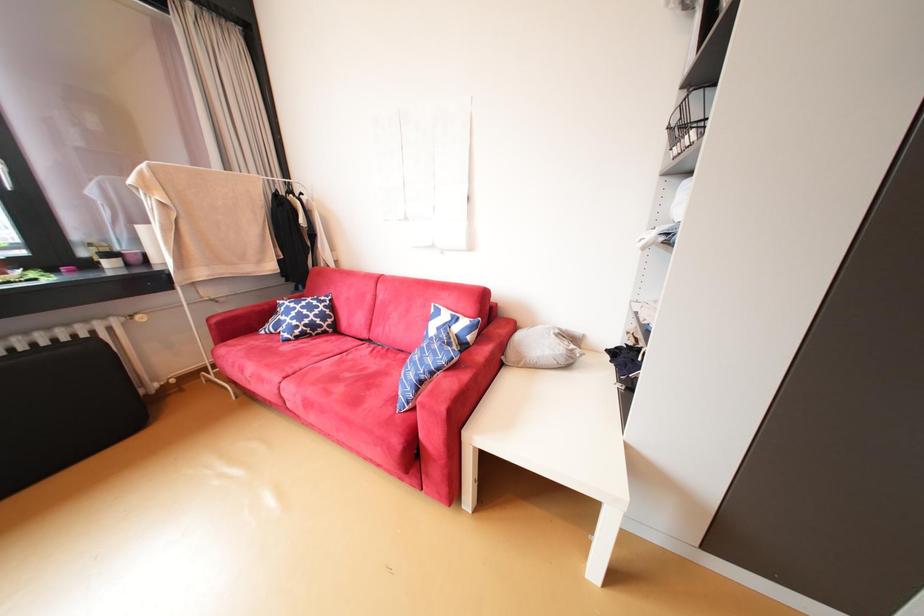
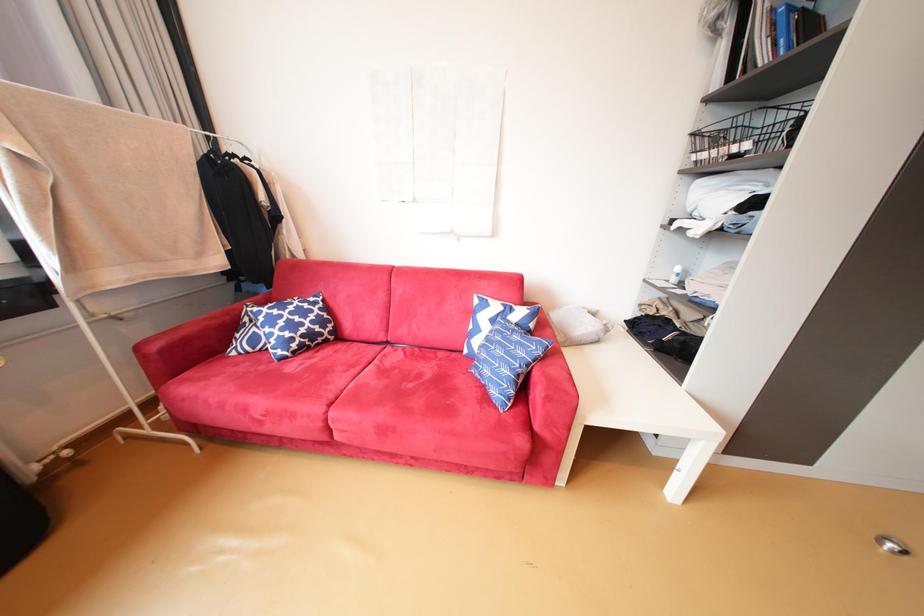
Question: The camera is either moving clockwise (left) or counter-clockwise (right) around the object. The first image is from the beginning of the video and the second image is from the end. Is the camera moving left or right when shooting the video?

Choices:
 (A) Left
 (B) Right

Answer: (A)